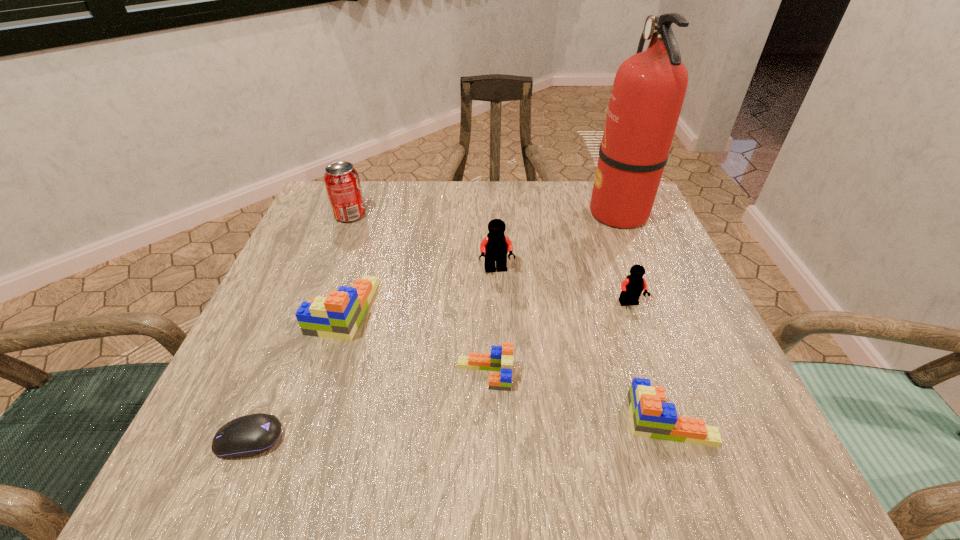
Where is `fire extinguisher`? This screenshot has height=540, width=960. fire extinguisher is located at coordinates [649, 88].

The height and width of the screenshot is (540, 960). I want to click on the tallest object, so click(649, 88).

Find the location of a particular element. soda can is located at coordinates (341, 179).

Where is `the third farthest object`? the third farthest object is located at coordinates pyautogui.click(x=495, y=247).

The height and width of the screenshot is (540, 960). I want to click on the bigger black Lego, so click(495, 247).

Image resolution: width=960 pixels, height=540 pixels. I want to click on the leftmost orange Lego, so click(x=337, y=316).

You are a GUI agent. You are given a task and a screenshot of the screen. Output one action in this format:
    pyautogui.click(x=<x>, y=<y>)
    Task: Click on the leftmost Lego
    
    Given the screenshot: What is the action you would take?
    [337, 316]

This screenshot has height=540, width=960. I want to click on the smaller black Lego, so click(632, 287).

At what (x,y) coordinates should I click in order to perform the action: click on the nearer black Lego. Please return your answer as a coordinate pair (x, y). Looking at the image, I should click on (632, 287).

Image resolution: width=960 pixels, height=540 pixels. Find the location of `the nearest Lego`. the nearest Lego is located at coordinates (651, 417).